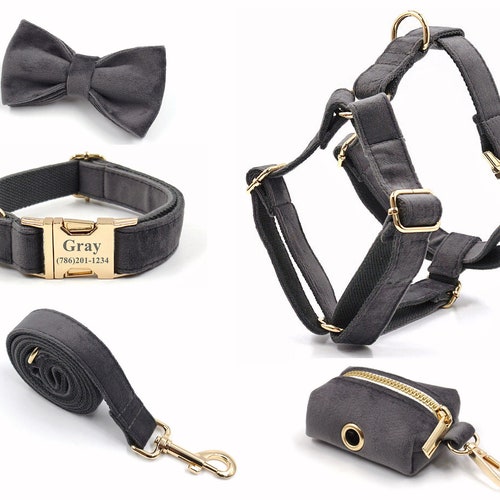
Image resolution: width=500 pixels, height=500 pixels. Identify the location of fabric. (393, 173), (128, 393), (346, 406), (135, 104).